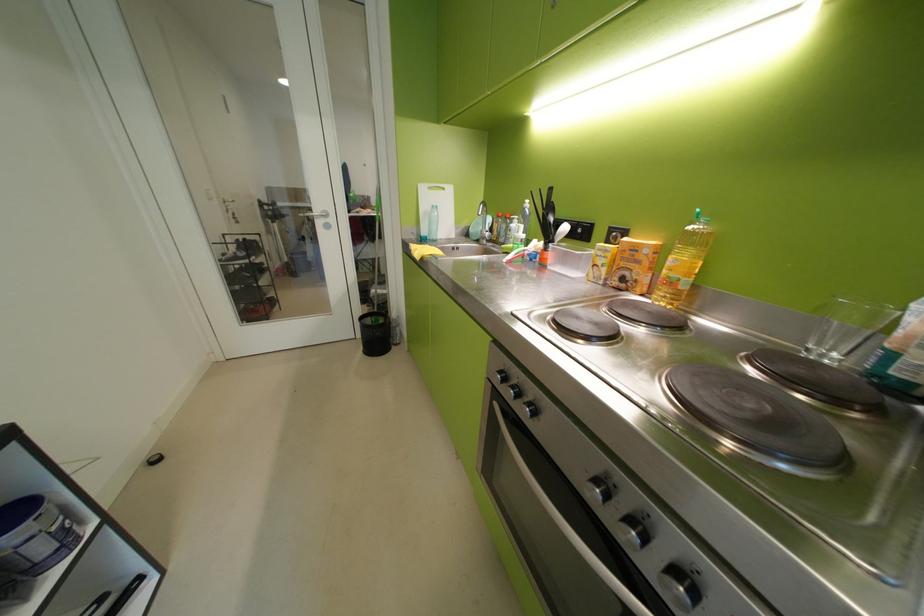
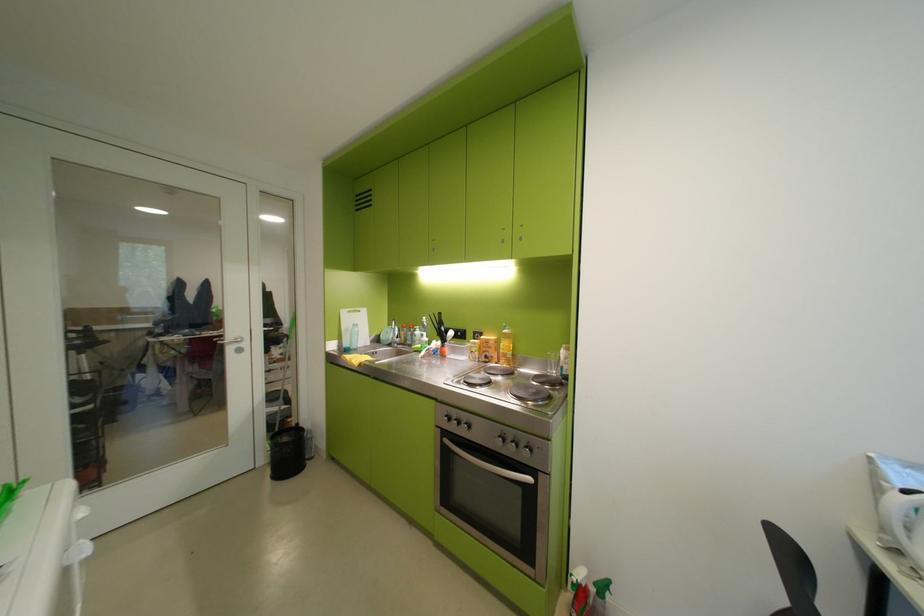
In the second image, find the point that corresponds to pixel 492 225 in the first image.

(400, 334)